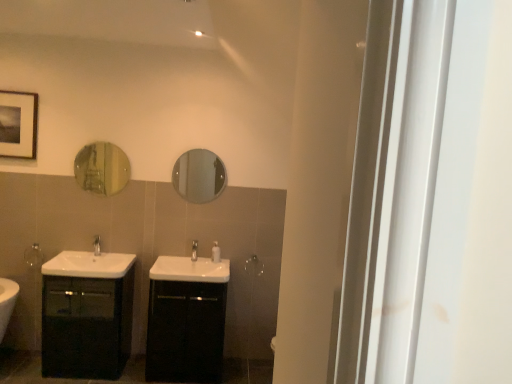
Question: Is silver metallic towel bar at left, which is counted as the 1th towel bar, starting from the front, in contact with satin nickel faucet at center, which ranks as the 2th tap in left-to-right order?

Choices:
 (A) yes
 (B) no

Answer: (B)

Question: From the image's perspective, is silver metallic towel bar at left, which is counted as the 1th towel bar, starting from the front, below satin nickel faucet at center, which ranks as the 2th tap in left-to-right order?

Choices:
 (A) no
 (B) yes

Answer: (B)

Question: Considering the relative sizes of silver metallic towel bar at left, placed as the first towel bar when sorted from left to right, and satin nickel faucet at center, placed as the first tap when sorted from right to left, in the image provided, is silver metallic towel bar at left, placed as the first towel bar when sorted from left to right, bigger than satin nickel faucet at center, placed as the first tap when sorted from right to left,?

Choices:
 (A) yes
 (B) no

Answer: (A)

Question: From a real-world perspective, is silver metallic towel bar at left, placed as the first towel bar when sorted from left to right, physically below satin nickel faucet at center, which ranks as the 2th tap in left-to-right order?

Choices:
 (A) no
 (B) yes

Answer: (B)

Question: Considering the relative positions of silver metallic towel bar at left, the second towel bar viewed from the back, and satin nickel faucet at center, which ranks as the 2th tap in left-to-right order, in the image provided, is silver metallic towel bar at left, the second towel bar viewed from the back, to the right of satin nickel faucet at center, which ranks as the 2th tap in left-to-right order, from the viewer's perspective?

Choices:
 (A) yes
 (B) no

Answer: (B)

Question: Is clear glass mirror at center, placed as the second mirror when sorted from left to right, to the left or to the right of matte black cabinet at left, the 1th bathroom cabinet positioned from the left, in the image?

Choices:
 (A) right
 (B) left

Answer: (A)

Question: From a real-world perspective, is clear glass mirror at center, the 1th mirror positioned from the right, above or below matte black cabinet at left, marked as the second bathroom cabinet in a right-to-left arrangement?

Choices:
 (A) above
 (B) below

Answer: (A)

Question: Choose the correct answer: Is clear glass mirror at center, placed as the second mirror when sorted from left to right, inside matte black cabinet at left, the 1th bathroom cabinet positioned from the left, or outside it?

Choices:
 (A) inside
 (B) outside

Answer: (B)

Question: Considering the positions of point (202, 192) and point (121, 266), is point (202, 192) closer or farther from the camera than point (121, 266)?

Choices:
 (A) farther
 (B) closer

Answer: (A)

Question: From their relative heights in the image, would you say black glossy cabinet at center, which is the second bathroom cabinet from left to right, is taller or shorter than clear glass mirror at center, placed as the second mirror when sorted from left to right?

Choices:
 (A) tall
 (B) short

Answer: (A)

Question: Is point (206, 258) positioned closer to the camera than point (193, 190)?

Choices:
 (A) closer
 (B) farther

Answer: (A)

Question: From a real-world perspective, is black glossy cabinet at center, the first bathroom cabinet from the right, positioned above or below clear glass mirror at center, placed as the second mirror when sorted from left to right?

Choices:
 (A) above
 (B) below

Answer: (B)

Question: From the image's perspective, is black glossy cabinet at center, which is the second bathroom cabinet from left to right, located above or below clear glass mirror at center, the 1th mirror positioned from the right?

Choices:
 (A) below
 (B) above

Answer: (A)

Question: Considering the positions of point (219, 258) and point (254, 266), is point (219, 258) closer or farther from the camera than point (254, 266)?

Choices:
 (A) farther
 (B) closer

Answer: (B)

Question: Do you think white glossy soap dispenser at center is within silver metallic towel bar at center, the 2th towel bar when ordered from left to right, or outside of it?

Choices:
 (A) inside
 (B) outside

Answer: (B)